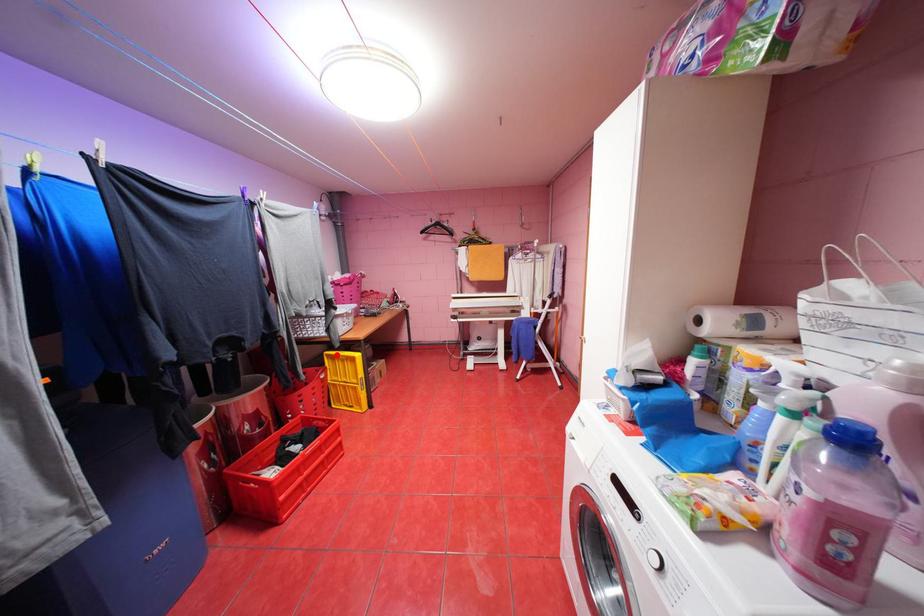
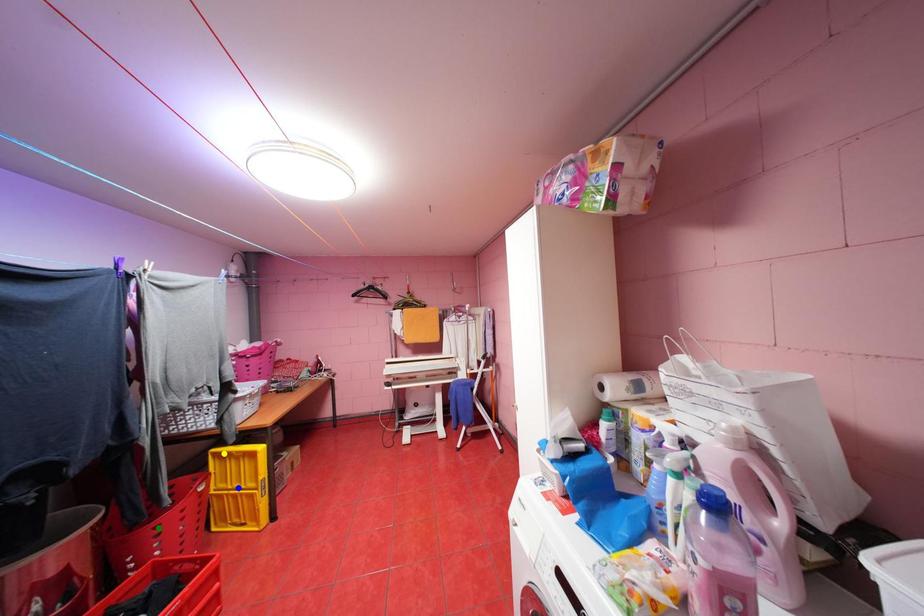
Question: I am providing you with two images of the same scene from different viewpoints. A red point is marked on the first image. You are given multiple points on the second image. Which point in image 2 is actually the same real-world point as the red point in image 1?

Choices:
 (A) yellow point
 (B) green point
 (C) blue point

Answer: (A)